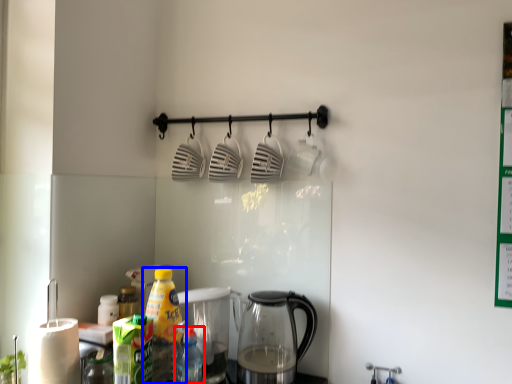
Question: Which of the following is the farthest to the observer, bottle (highlighted by a red box) or bottle (highlighted by a blue box)?

Choices:
 (A) bottle
 (B) bottle

Answer: (B)